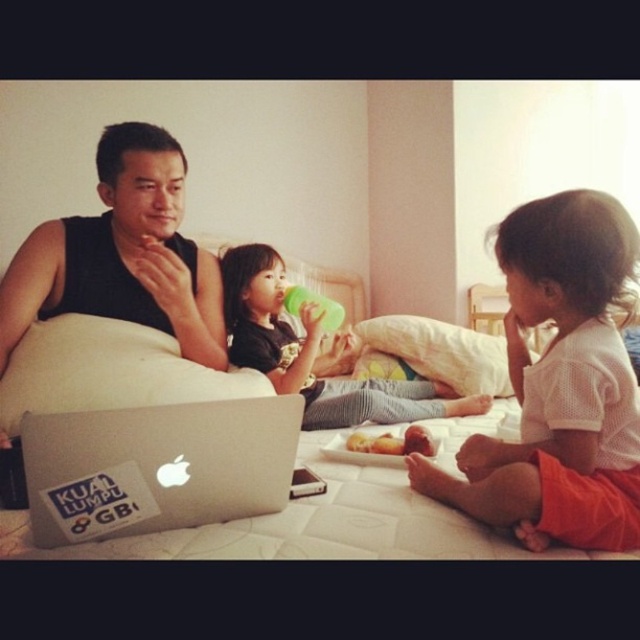
In the scene shown: You are a photographer taking a portrait of two people wearing the white textured shirt at center and matte black shirt at center. Which shirt would you suggest the person adjust their posture to avoid looking too narrow?

The white textured shirt at center has a lesser width compared to matte black shirt at center. Therefore, the person wearing the white textured shirt at center should adjust their posture to avoid looking too narrow.

You are standing in the bedroom and want to place a small plant between the two points, point (614, 502) and point (371, 467). Which point should the plant be closer to in order to be nearer to the viewer?

The plant should be closer to point (614, 502) because it is nearer to the viewer compared to point (371, 467).

You are a photographer trying to capture a candid shot of the two people at the center of the bed. Since you want to ensure both the white textured shirt at center and the black matte tank top at center are clearly visible in the frame, which one should you focus on first to ensure proper depth of field?

The white textured shirt at center is located below the black matte tank top at center, so focusing on the black matte tank top at center first will ensure both are in focus due to its position closer to the camera.